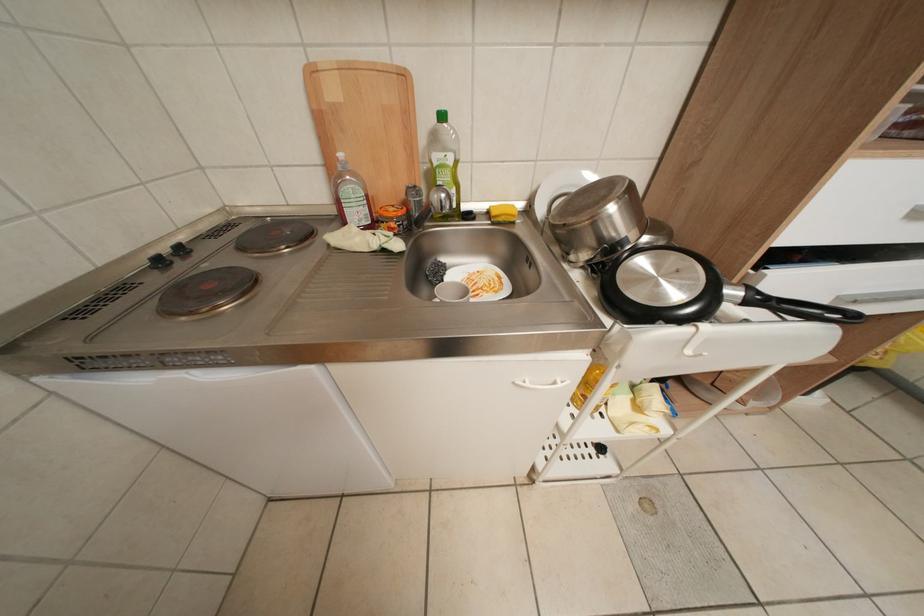
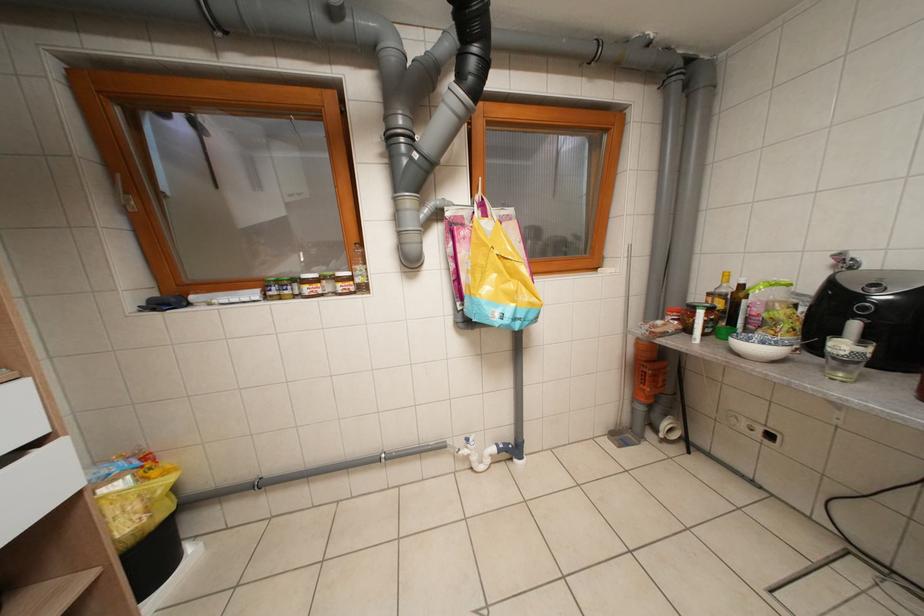
Question: Based on the continuous images, in which direction is the camera rotating? Reply with the corresponding letter.

Choices:
 (A) Left
 (B) Right
 (C) Up
 (D) Down

Answer: (B)